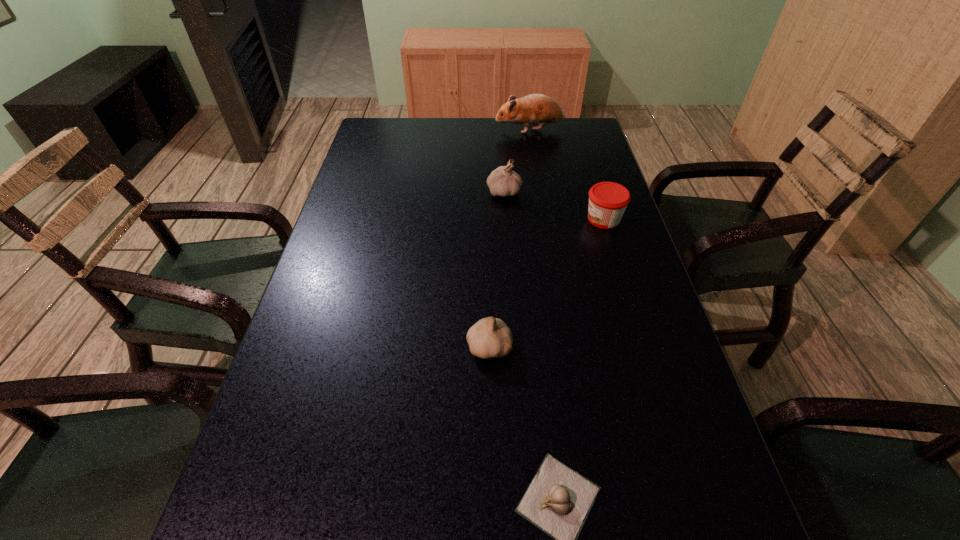
At what (x,y) coordinates should I click in order to perform the action: click on the farthest object. Please return your answer as a coordinate pair (x, y). Looking at the image, I should click on (535, 109).

The width and height of the screenshot is (960, 540). Identify the location of the second farthest object. (503, 181).

You are a GUI agent. You are given a task and a screenshot of the screen. Output one action in this format:
    pyautogui.click(x=<x>, y=<y>)
    Task: Click on the farthest garlic
    Image resolution: width=960 pixels, height=540 pixels.
    Given the screenshot: What is the action you would take?
    pyautogui.click(x=503, y=181)

Identify the location of jam. (607, 200).

Find the location of a particular element. the second tallest garlic is located at coordinates tap(490, 337).

You are a GUI agent. You are given a task and a screenshot of the screen. Output one action in this format:
    pyautogui.click(x=<x>, y=<y>)
    Task: Click on the fourth farthest object
    Image resolution: width=960 pixels, height=540 pixels.
    Given the screenshot: What is the action you would take?
    pyautogui.click(x=490, y=337)

Identify the location of vacant space located 0.350m at the face of the hamster. This screenshot has height=540, width=960. (393, 130).

Locate an element on the screen. The height and width of the screenshot is (540, 960). vacant space located at the face of the hamster is located at coordinates (413, 130).

Where is `free location located at the face of the hamster`? free location located at the face of the hamster is located at coordinates (407, 130).

What are the coordinates of `vacant space located on the front of the fourth nearest object` in the screenshot? It's located at (506, 226).